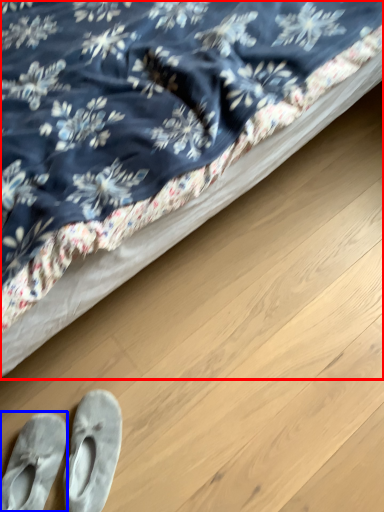
Question: Which point is closer to the camera, bed (highlighted by a red box) or footwear (highlighted by a blue box)?

Choices:
 (A) bed
 (B) footwear

Answer: (A)